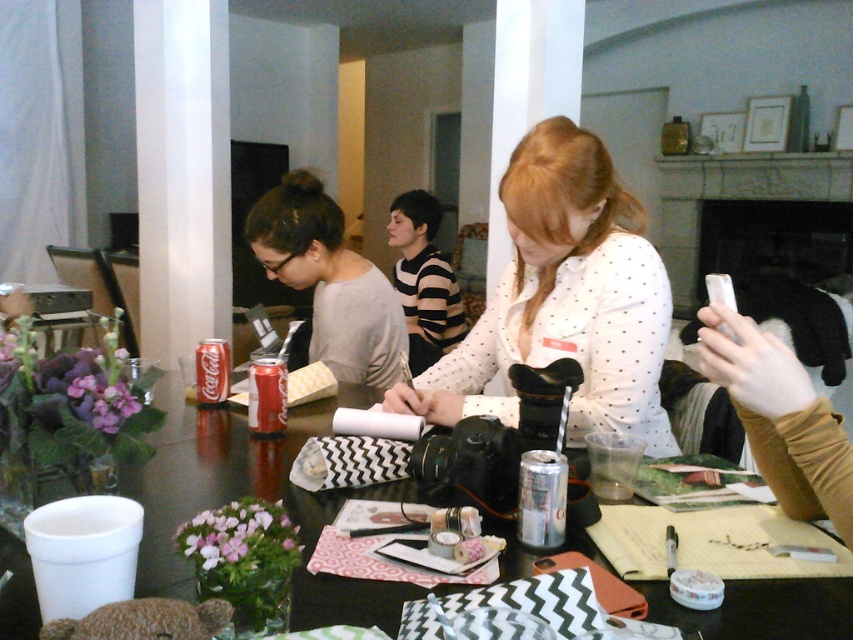
You are looking at the table from above. There are two points marked on the table surface, one at point (140, 579) and the other at point (221, 394). Which point is closer to you?

Point (140, 579) is closer to the camera than point (221, 394).